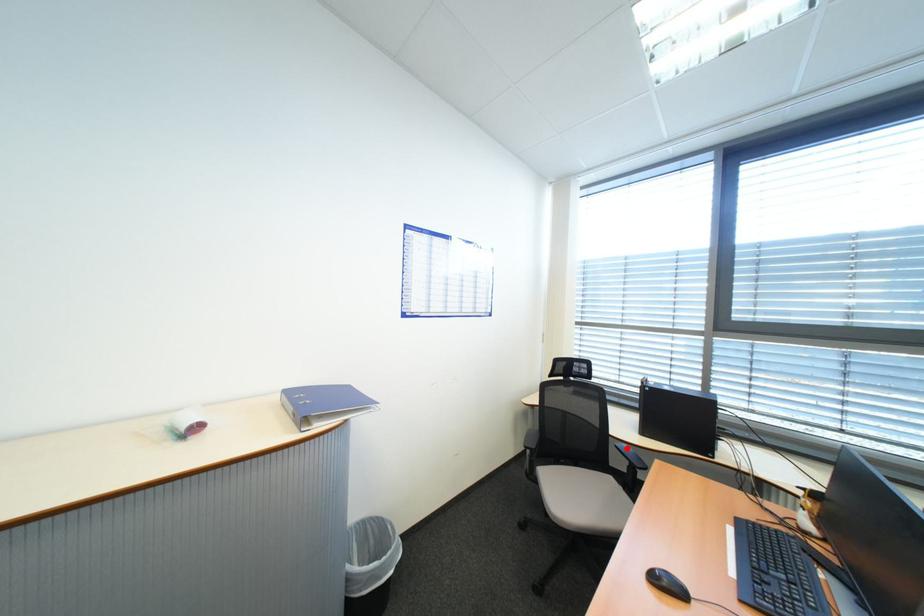
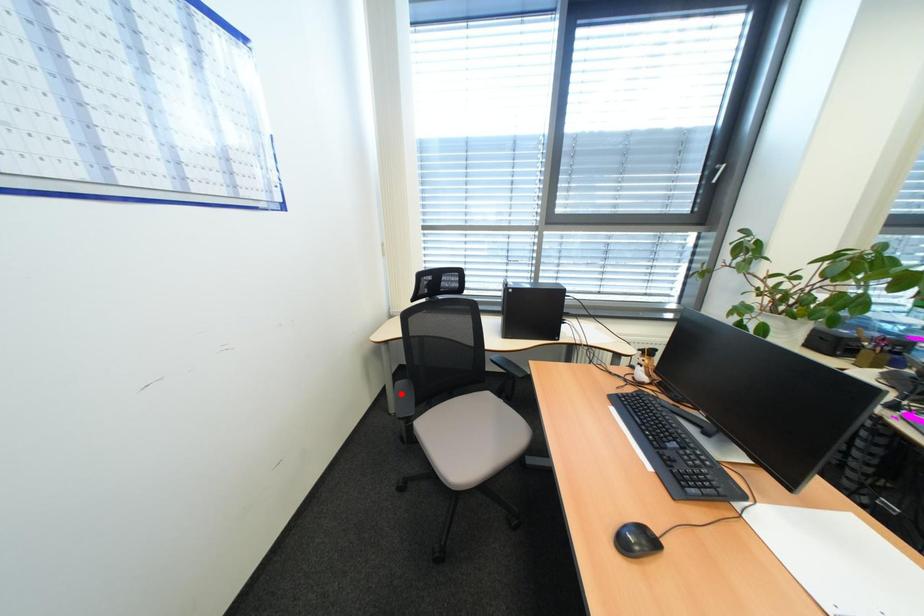
I am providing you with two images of the same scene from different viewpoints. A red point is marked on the first image and another point is marked on the second image. Is the marked point in image1 the same physical position as the marked point in image2?

No